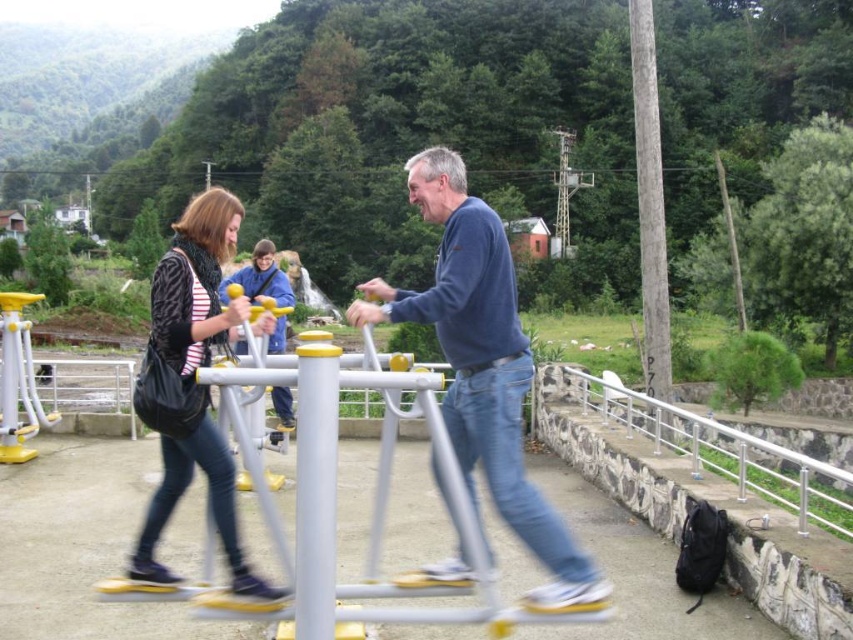
Question: Among these objects, which one is farthest from the camera?

Choices:
 (A) matte black bag at center
 (B) satin silver railing at lower right
 (C) blue cotton sweater at center

Answer: (B)

Question: Is the position of blue cotton sweater at center less distant than that of matte black bag at center?

Choices:
 (A) yes
 (B) no

Answer: (A)

Question: Is blue cotton sweater at center above satin silver railing at lower right?

Choices:
 (A) no
 (B) yes

Answer: (B)

Question: Which of the following is the closest to the observer?

Choices:
 (A) 589,406
 (B) 424,316
 (C) 207,429

Answer: (B)

Question: Is matte black bag at center behind satin silver railing at lower right?

Choices:
 (A) yes
 (B) no

Answer: (B)

Question: Which is farther from the satin silver railing at lower right?

Choices:
 (A) matte black bag at center
 (B) blue cotton sweater at center

Answer: (A)